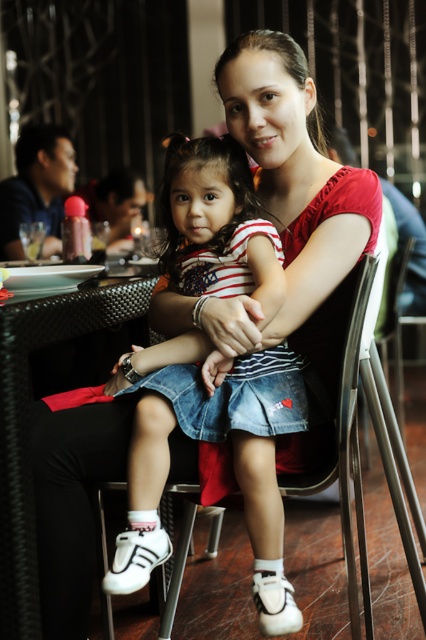
Question: Does black woven table at lower left have a lesser width compared to metallic silver chair at center?

Choices:
 (A) yes
 (B) no

Answer: (A)

Question: Is black woven table at lower left behind metallic silver chair at center?

Choices:
 (A) yes
 (B) no

Answer: (B)

Question: Does black woven table at lower left appear under metallic silver chair at center?

Choices:
 (A) yes
 (B) no

Answer: (B)

Question: Which object is closer to the camera taking this photo?

Choices:
 (A) metallic silver chair at center
 (B) black woven table at lower left

Answer: (B)

Question: Which object is farther from the camera taking this photo?

Choices:
 (A) black woven table at lower left
 (B) metallic silver chair at center

Answer: (B)